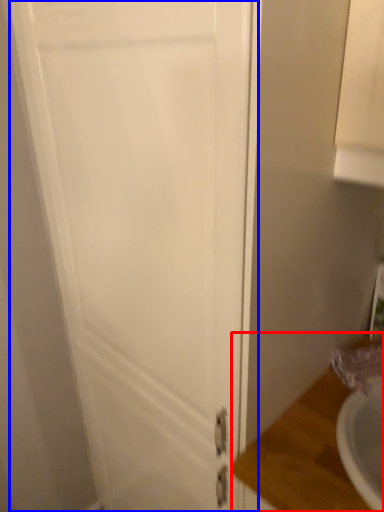
Question: Among these objects, which one is nearest to the camera, counter top (highlighted by a red box) or door (highlighted by a blue box)?

Choices:
 (A) counter top
 (B) door

Answer: (B)